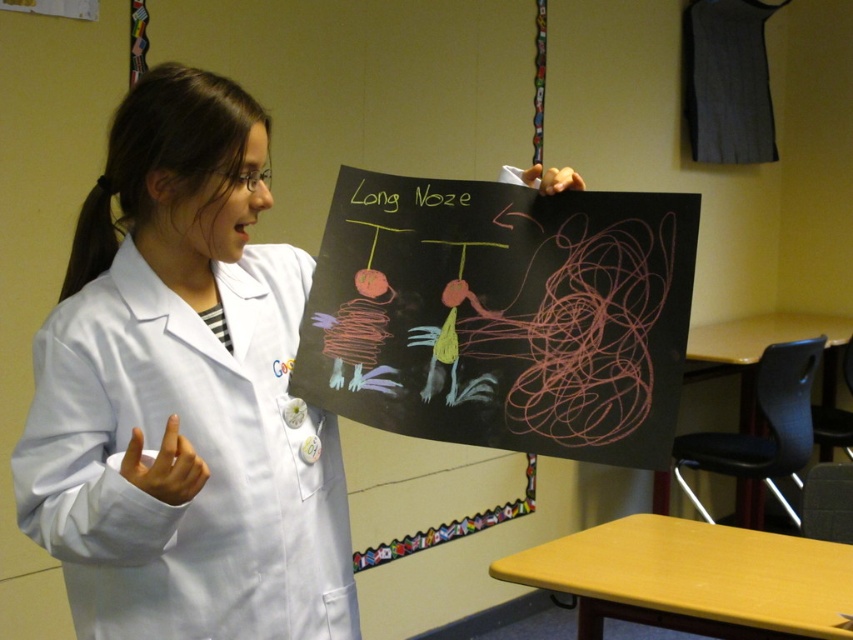
Consider the image. You are a student sitting in the classroom and you see the black chalkboard at center and the green chalk writing at upper center. Which object is located to the right of the other?

The black chalkboard at center is to the right of the green chalk writing at upper center.

You are a student sitting at the back of the classroom. You want to see the text on the black chalkboard at center clearly. However, there is a white lab coat at center in your line of sight. What should you do?

The white lab coat at center is closer to you than the black chalkboard at center, so you should ask the person wearing the white lab coat at center to move aside so you can see the black chalkboard at center better.

You are a student in the classroom and need to write a note on the board. Which object, the black chalkboard at center or the green chalk writing at upper center, can you use to write your note?

The black chalkboard at center can be used to write the note since it is the larger object and the green chalk writing at upper center is just text already present on the board.